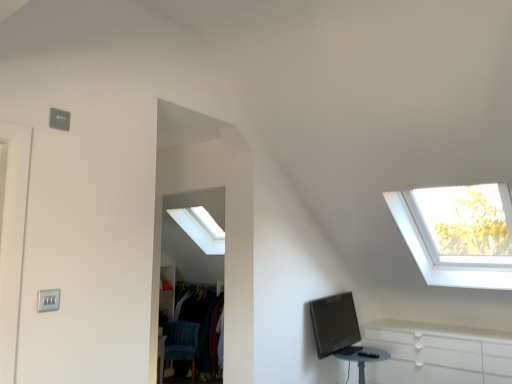
Locate an element on the screen. The width and height of the screenshot is (512, 384). velvet blue swivel chair at lower left is located at coordinates (181, 343).

What do you see at coordinates (181, 343) in the screenshot? I see `velvet blue swivel chair at lower left` at bounding box center [181, 343].

Locate an element on the screen. satin silver switch at lower left is located at coordinates (48, 300).

Image resolution: width=512 pixels, height=384 pixels. Describe the element at coordinates (334, 323) in the screenshot. I see `black glossy computer monitor at lower right` at that location.

Find the location of a particular element. velvet blue swivel chair at lower left is located at coordinates (181, 343).

The height and width of the screenshot is (384, 512). Find the location of `swivel chair below the black glossy computer monitor at lower right (from a real-world perspective)`. swivel chair below the black glossy computer monitor at lower right (from a real-world perspective) is located at coordinates (181, 343).

Is black glossy computer monitor at lower right looking in the opposite direction of velvet blue swivel chair at lower left?

Yes, black glossy computer monitor at lower right's orientation is away from velvet blue swivel chair at lower left.

Is black glossy computer monitor at lower right taller or shorter than velvet blue swivel chair at lower left?

Considering their sizes, black glossy computer monitor at lower right has less height than velvet blue swivel chair at lower left.

Can you confirm if black glossy computer monitor at lower right is positioned to the right of velvet blue swivel chair at lower left?

Yes, black glossy computer monitor at lower right is to the right of velvet blue swivel chair at lower left.

Considering the sizes of objects velvet blue swivel chair at lower left and black glossy computer monitor at lower right in the image provided, who is smaller, velvet blue swivel chair at lower left or black glossy computer monitor at lower right?

black glossy computer monitor at lower right is smaller.

From the image's perspective, between velvet blue swivel chair at lower left and black glossy computer monitor at lower right, which one is located above?

black glossy computer monitor at lower right, from the image's perspective.

Could you measure the distance between velvet blue swivel chair at lower left and black glossy computer monitor at lower right?

velvet blue swivel chair at lower left is 6.08 feet from black glossy computer monitor at lower right.

Does velvet blue swivel chair at lower left turn towards black glossy computer monitor at lower right?

No, velvet blue swivel chair at lower left does not turn towards black glossy computer monitor at lower right.

Would you say matte black table at lower right is outside black glossy computer monitor at lower right?

matte black table at lower right is positioned outside black glossy computer monitor at lower right.

Consider the image. Which object is positioned more to the right, matte black table at lower right or black glossy computer monitor at lower right?

matte black table at lower right is more to the right.

Are matte black table at lower right and black glossy computer monitor at lower right beside each other?

matte black table at lower right and black glossy computer monitor at lower right are clearly separated.

Between matte black table at lower right and black glossy computer monitor at lower right, which one has more height?

black glossy computer monitor at lower right is taller.

In terms of height, does matte black table at lower right look taller or shorter compared to satin silver switch at lower left?

matte black table at lower right is taller than satin silver switch at lower left.

Is matte black table at lower right next to satin silver switch at lower left?

There is a gap between matte black table at lower right and satin silver switch at lower left.

The height and width of the screenshot is (384, 512). Identify the location of electric outlet above the matte black table at lower right (from a real-world perspective). coord(48,300).

Where is `table on the right of black glossy computer monitor at lower right`? Image resolution: width=512 pixels, height=384 pixels. table on the right of black glossy computer monitor at lower right is located at coordinates (362, 357).

How many degrees apart are the facing directions of black glossy computer monitor at lower right and matte black table at lower right?

The facing directions of black glossy computer monitor at lower right and matte black table at lower right are 0.118 degrees apart.

Between black glossy computer monitor at lower right and matte black table at lower right, which one has smaller width?

Thinner between the two is black glossy computer monitor at lower right.

From a real-world perspective, which object rests below the other?

In real-world perspective, matte black table at lower right is lower.

Can you confirm if matte black table at lower right is shorter than velvet blue swivel chair at lower left?

Yes, matte black table at lower right is shorter than velvet blue swivel chair at lower left.

Does point (383, 360) come closer to viewer compared to point (174, 355)?

Yes, it is in front of point (174, 355).

Who is bigger, matte black table at lower right or velvet blue swivel chair at lower left?

velvet blue swivel chair at lower left.

Would you say velvet blue swivel chair at lower left is a long distance from matte black table at lower right?

Yes, velvet blue swivel chair at lower left is far from matte black table at lower right.

Which object is further away from the camera taking this photo, velvet blue swivel chair at lower left or matte black table at lower right?

Positioned behind is velvet blue swivel chair at lower left.

From the picture: Is velvet blue swivel chair at lower left located outside matte black table at lower right?

Absolutely, velvet blue swivel chair at lower left is external to matte black table at lower right.

Image resolution: width=512 pixels, height=384 pixels. Identify the location of computer monitor located in front of the velvet blue swivel chair at lower left. (334, 323).

You are a GUI agent. You are given a task and a screenshot of the screen. Output one action in this format:
    pyautogui.click(x=<x>, y=<y>)
    Task: Click on the swivel chair that is under the black glossy computer monitor at lower right (from a real-world perspective)
    The width and height of the screenshot is (512, 384).
    Given the screenshot: What is the action you would take?
    point(181,343)

Looking at the image, which one is located closer to matte black table at lower right, satin silver switch at lower left or velvet blue swivel chair at lower left?

Based on the image, velvet blue swivel chair at lower left appears to be nearer to matte black table at lower right.

When comparing their distances from black glossy computer monitor at lower right, does matte black table at lower right or velvet blue swivel chair at lower left seem closer?

matte black table at lower right is positioned closer to the anchor black glossy computer monitor at lower right.

From the image, which object appears to be nearer to satin silver switch at lower left, velvet blue swivel chair at lower left or black glossy computer monitor at lower right?

The object closer to satin silver switch at lower left is black glossy computer monitor at lower right.

Estimate the real-world distances between objects in this image. Which object is closer to black glossy computer monitor at lower right, velvet blue swivel chair at lower left or satin silver switch at lower left?

velvet blue swivel chair at lower left.

Considering their positions, is satin silver switch at lower left positioned closer to velvet blue swivel chair at lower left than black glossy computer monitor at lower right?

black glossy computer monitor at lower right.

Which object lies further to the anchor point velvet blue swivel chair at lower left, matte black table at lower right or black glossy computer monitor at lower right?

Based on the image, matte black table at lower right appears to be further to velvet blue swivel chair at lower left.

Which object lies further to the anchor point black glossy computer monitor at lower right, satin silver switch at lower left or velvet blue swivel chair at lower left?

satin silver switch at lower left is positioned further to the anchor black glossy computer monitor at lower right.

Which object lies nearer to the anchor point matte black table at lower right, satin silver switch at lower left or black glossy computer monitor at lower right?

Based on the image, black glossy computer monitor at lower right appears to be nearer to matte black table at lower right.

The height and width of the screenshot is (384, 512). I want to click on table positioned between satin silver switch at lower left and velvet blue swivel chair at lower left from near to far, so click(362, 357).

In order to click on computer monitor between velvet blue swivel chair at lower left and matte black table at lower right from left to right in this screenshot , I will do `click(334, 323)`.

Where is `computer monitor between satin silver switch at lower left and velvet blue swivel chair at lower left from front to back`? computer monitor between satin silver switch at lower left and velvet blue swivel chair at lower left from front to back is located at coordinates (334, 323).

Where is `computer monitor located between satin silver switch at lower left and matte black table at lower right in the left-right direction`? This screenshot has height=384, width=512. computer monitor located between satin silver switch at lower left and matte black table at lower right in the left-right direction is located at coordinates (334, 323).